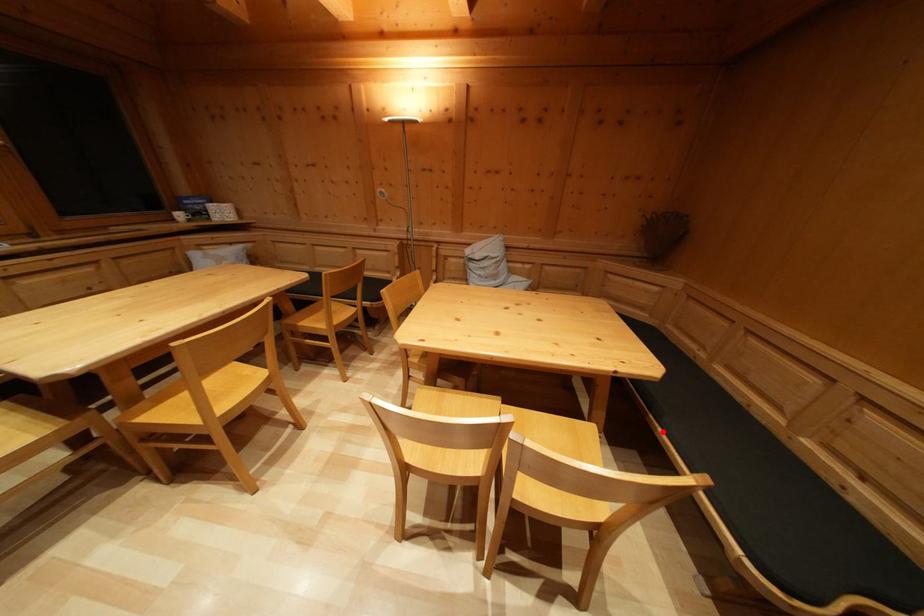
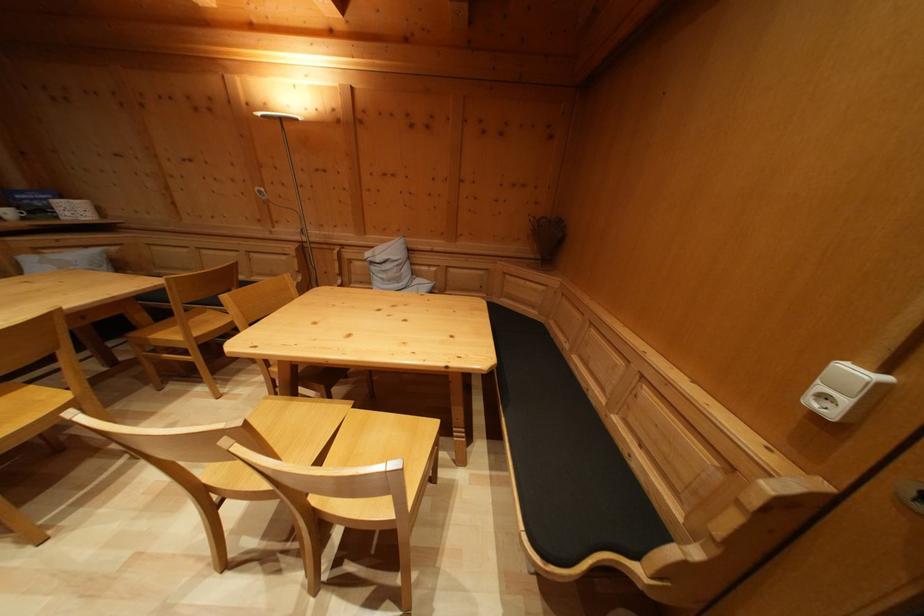
Question: I am providing you with two images of the same scene from different viewpoints. Given a red point in image1, look at the same physical point in image2. Is it:

Choices:
 (A) Closer to the viewpoint
 (B) Farther from the viewpoint

Answer: (A)